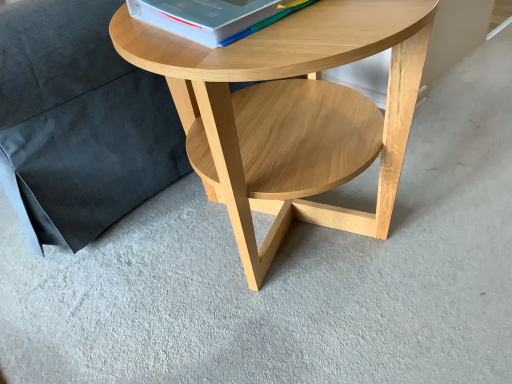
Find the location of `free space in front of white paper at upper center`. free space in front of white paper at upper center is located at coordinates (270, 48).